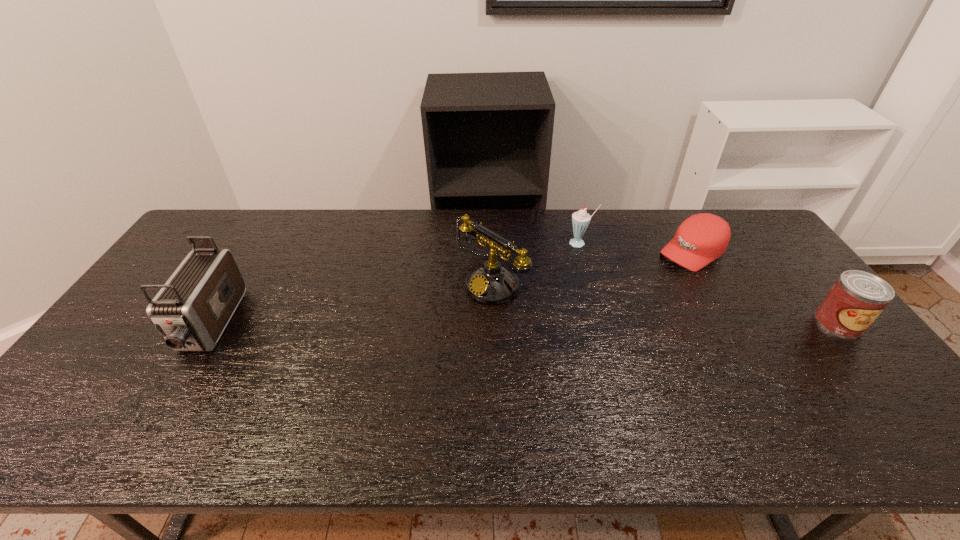
Identify the location of the leftmost object. (191, 311).

You are a GUI agent. You are given a task and a screenshot of the screen. Output one action in this format:
    pyautogui.click(x=<x>, y=<y>)
    Task: Click on the second shortest object
    The height and width of the screenshot is (540, 960).
    Given the screenshot: What is the action you would take?
    pyautogui.click(x=857, y=298)

Find the location of a particular element. can is located at coordinates (857, 298).

Find the location of a particular element. Image resolution: width=960 pixels, height=540 pixels. milkshake is located at coordinates (580, 220).

The width and height of the screenshot is (960, 540). Find the location of `cap`. cap is located at coordinates (700, 239).

This screenshot has height=540, width=960. What are the coordinates of `the shortest object` in the screenshot? It's located at (700, 239).

This screenshot has height=540, width=960. In order to click on telephone in this screenshot , I will do `click(491, 283)`.

Where is `vacant region located at the lens of the camcorder`? The image size is (960, 540). vacant region located at the lens of the camcorder is located at coordinates (164, 402).

Where is `vacant space located on the back of the can`? vacant space located on the back of the can is located at coordinates (802, 278).

You are a GUI agent. You are given a task and a screenshot of the screen. Output one action in this format:
    pyautogui.click(x=<x>, y=<y>)
    Task: Click on the vacant space located 0.150m on the straw side of the milkshake
    This screenshot has height=540, width=960.
    Given the screenshot: What is the action you would take?
    pyautogui.click(x=545, y=268)